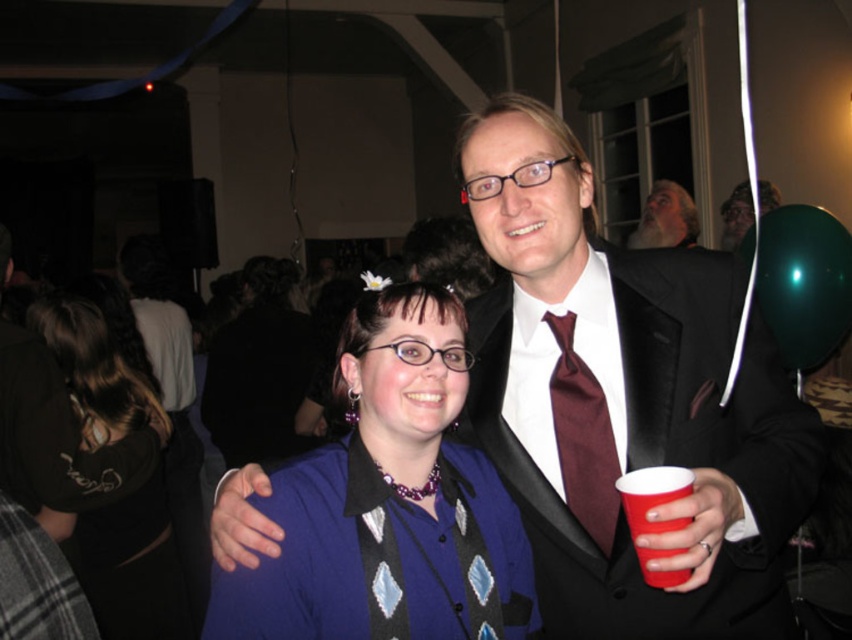
You are a bartender at the party and need to deliver a drink to the guest wearing the shiny black suit at center. The red plastic cup at right is already filled with a beverage. Can you place the cup close enough to the suit without it spilling?

The distance between the shiny black suit at center and the red plastic cup at right is 11.07 inches. Since the cup is already at that distance, placing it there would be safe and close enough without risking spillage.

You are organizing a closet and need to place the matte blue shirt at center and the dark brown leather jacket at lower left on a shelf. If the shelf has limited width, which item should you place first to ensure both fit?

The matte blue shirt at center is thinner than the dark brown leather jacket at lower left, so you should place the dark brown leather jacket at lower left first to accommodate its wider width before placing the thinner matte blue shirt at center.

You are organizing a photo shoot and need to ensure that the shiny black suit at center and the matte blue shirt at center fit within a rectangular frame. Which object requires more horizontal space to be fully captured in the frame?

The shiny black suit at center requires more horizontal space because it might be wider than the matte blue shirt at center.